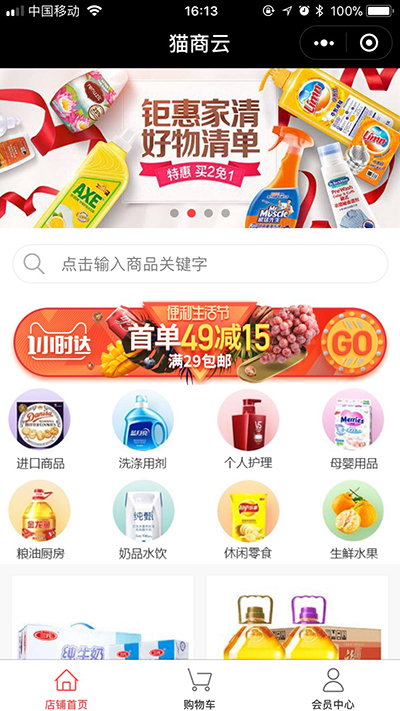
I want to click on box, so click(x=373, y=139), click(x=349, y=643), click(x=160, y=646), click(x=98, y=636).